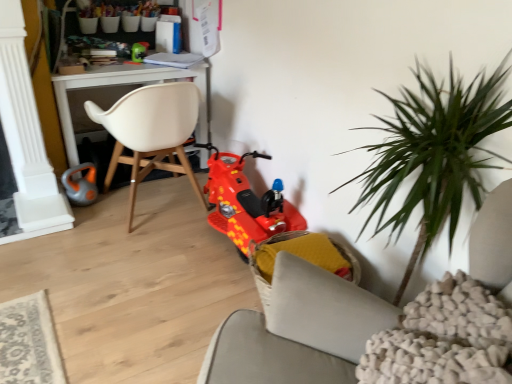
Question: Which direction should I rotate to face green plastic toy at upper center, the second toy positioned from the left, — up or down?

Choices:
 (A) up
 (B) down

Answer: (A)

Question: Is yellow fabric chair at lower center, the 1th chair from the right, not close to shiny plastic scooter at center, the first toy from the bottom?

Choices:
 (A) yes
 (B) no

Answer: (B)

Question: From a real-world perspective, does yellow fabric chair at lower center, the 1th chair from the right, stand above shiny plastic scooter at center, the first toy from the bottom?

Choices:
 (A) yes
 (B) no

Answer: (B)

Question: Does yellow fabric chair at lower center, which appears as the 1th chair when ordered from the bottom, appear on the right side of shiny plastic scooter at center, placed as the first toy when sorted from right to left?

Choices:
 (A) yes
 (B) no

Answer: (A)

Question: Is yellow fabric chair at lower center, the second chair when ordered from top to bottom, at the left side of shiny plastic scooter at center, placed as the first toy when sorted from right to left?

Choices:
 (A) yes
 (B) no

Answer: (B)

Question: Can you confirm if yellow fabric chair at lower center, acting as the second chair starting from the left, is bigger than shiny plastic scooter at center, which appears as the 3th toy when viewed from the left?

Choices:
 (A) no
 (B) yes

Answer: (A)

Question: Is yellow fabric chair at lower center, the second chair when ordered from top to bottom, shorter than shiny plastic scooter at center, which appears as the 3th toy when viewed from the top?

Choices:
 (A) yes
 (B) no

Answer: (A)

Question: Is white matte chair at center, marked as the 1th chair in a left-to-right arrangement, beside yellow fabric chair at lower center, acting as the second chair starting from the left?

Choices:
 (A) yes
 (B) no

Answer: (B)

Question: Is white matte chair at center, marked as the 1th chair in a left-to-right arrangement, facing towards yellow fabric chair at lower center, the second chair when ordered from top to bottom?

Choices:
 (A) yes
 (B) no

Answer: (B)

Question: Is white matte chair at center, which is the 2th chair from right to left, behind yellow fabric chair at lower center, which appears as the 1th chair when ordered from the bottom?

Choices:
 (A) yes
 (B) no

Answer: (A)

Question: Is white matte chair at center, the 1th chair when ordered from top to bottom, facing away from yellow fabric chair at lower center, the second chair when ordered from top to bottom?

Choices:
 (A) yes
 (B) no

Answer: (A)

Question: Can you confirm if white matte chair at center, marked as the 1th chair in a left-to-right arrangement, is positioned to the left of yellow fabric chair at lower center, acting as the second chair starting from the left?

Choices:
 (A) no
 (B) yes

Answer: (B)

Question: Considering the relative sizes of white matte chair at center, marked as the 1th chair in a left-to-right arrangement, and yellow fabric chair at lower center, acting as the second chair starting from the left, in the image provided, is white matte chair at center, marked as the 1th chair in a left-to-right arrangement, thinner than yellow fabric chair at lower center, acting as the second chair starting from the left,?

Choices:
 (A) no
 (B) yes

Answer: (A)

Question: Is orange rubber toy at lower left, which appears as the third toy when viewed from the right, shorter than yellow fabric chair at lower center, which appears as the 1th chair when ordered from the bottom?

Choices:
 (A) no
 (B) yes

Answer: (B)